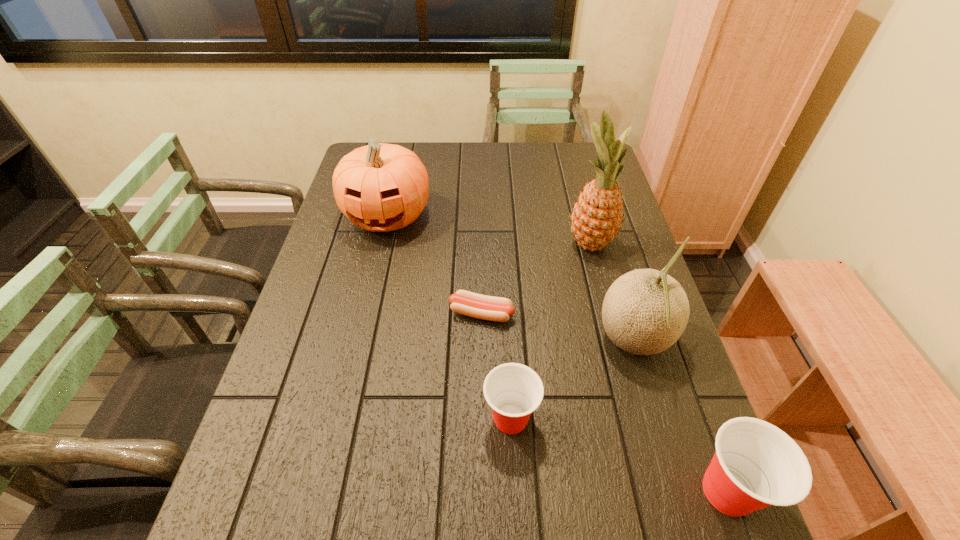
At what (x,y) coordinates should I click in order to perform the action: click on vacant space located on the front-facing side of the leftmost object. Please return your answer as a coordinate pair (x, y). This screenshot has height=540, width=960. Looking at the image, I should click on (363, 321).

Locate an element on the screen. This screenshot has height=540, width=960. blank area located 0.330m on the left of the tallest object is located at coordinates (454, 244).

Identify the location of vacant area situated on the back of the cantaloup. The height and width of the screenshot is (540, 960). (614, 275).

Where is `free space located 0.280m on the right of the sausage`? This screenshot has width=960, height=540. free space located 0.280m on the right of the sausage is located at coordinates (624, 313).

Locate an element on the screen. This screenshot has height=540, width=960. object located at the near edge is located at coordinates (756, 465).

Identify the location of object present at the left edge. This screenshot has height=540, width=960. (380, 187).

I want to click on cup that is at the right edge, so click(x=756, y=465).

In order to click on pineapple that is positioned at the right edge in this screenshot , I will do `click(597, 216)`.

Where is `cantaloup located in the right edge section of the desktop`? cantaloup located in the right edge section of the desktop is located at coordinates (645, 311).

Identify the location of object that is at the near right corner. The height and width of the screenshot is (540, 960). (756, 465).